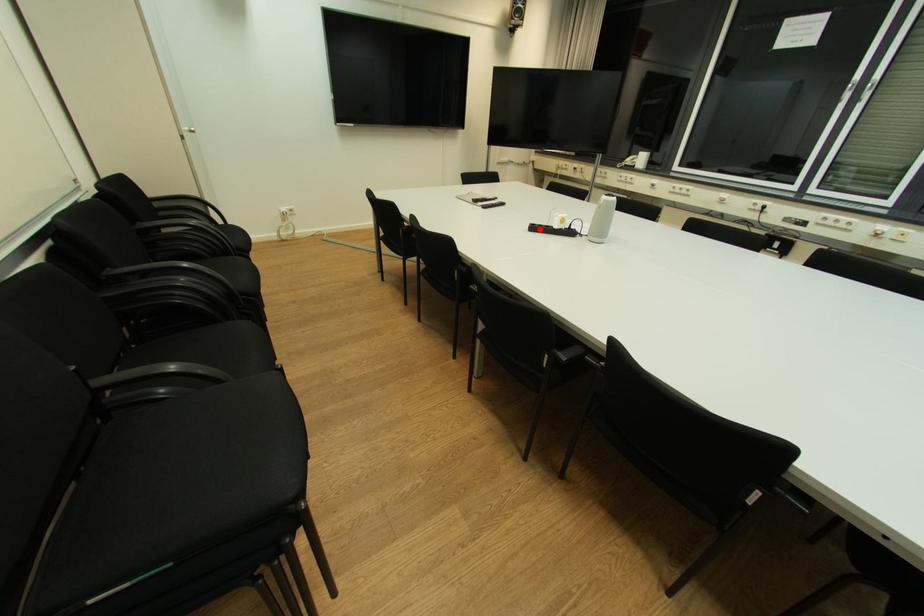
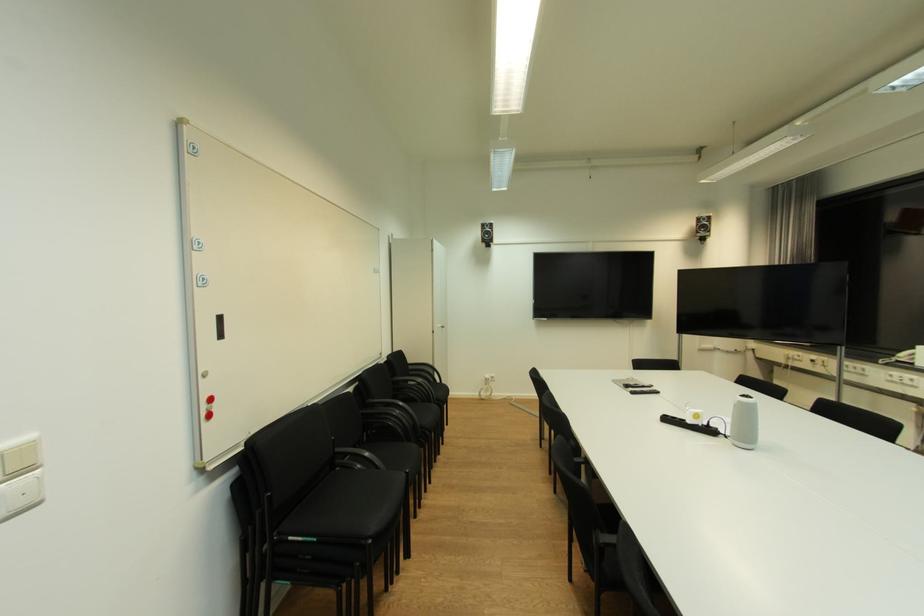
Locate, in the second image, the point that corresponds to the highlighted location in the first image.

(674, 421)